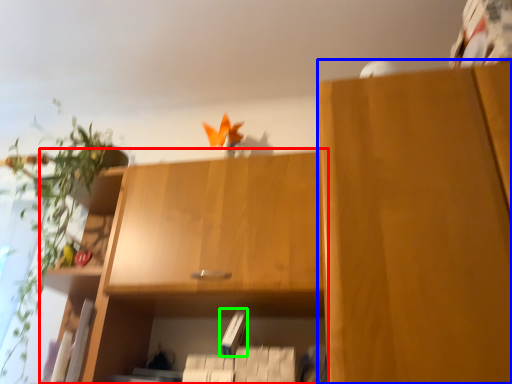
Question: Which object is the closest to the cabinetry (highlighted by a red box)? Choose among these: cabinetry (highlighted by a blue box) or paperback book (highlighted by a green box).

Choices:
 (A) cabinetry
 (B) paperback book

Answer: (B)